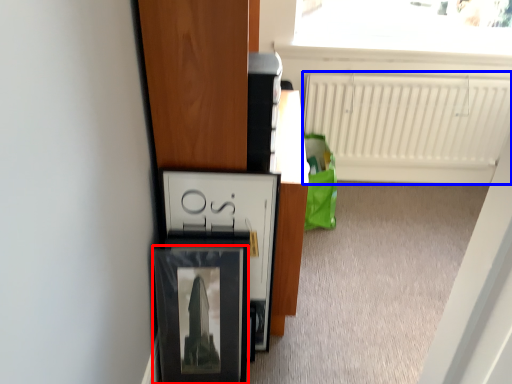
Question: Which of the following is the farthest to the observer, picture frame (highlighted by a red box) or radiator (highlighted by a blue box)?

Choices:
 (A) picture frame
 (B) radiator

Answer: (B)